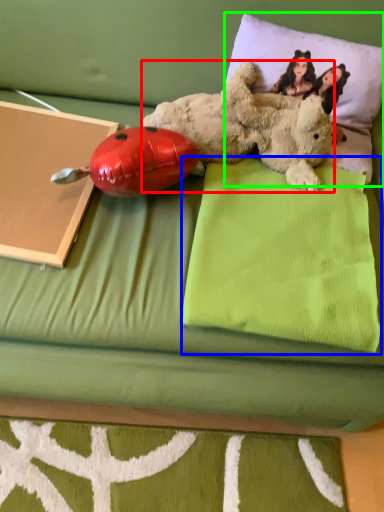
Question: Which object is the closest to the teddy bear (highlighted by a red box)? Choose among these: pillow (highlighted by a blue box) or pillow (highlighted by a green box).

Choices:
 (A) pillow
 (B) pillow

Answer: (B)